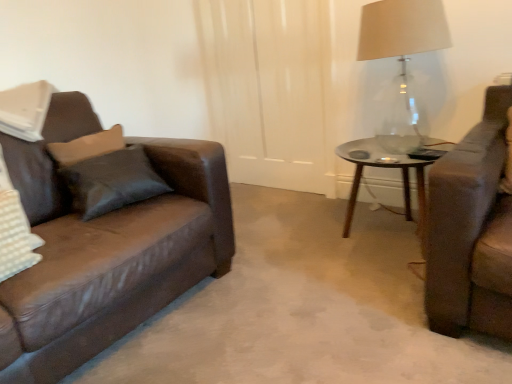
Question: From the image's perspective, does transparent glass table at center appear higher than clear glass table lamp at upper right?

Choices:
 (A) no
 (B) yes

Answer: (A)

Question: Is transparent glass table at center oriented towards clear glass table lamp at upper right?

Choices:
 (A) yes
 (B) no

Answer: (B)

Question: Can you confirm if transparent glass table at center is thinner than clear glass table lamp at upper right?

Choices:
 (A) no
 (B) yes

Answer: (A)

Question: Is transparent glass table at center at the left side of clear glass table lamp at upper right?

Choices:
 (A) no
 (B) yes

Answer: (A)

Question: Considering the relative sizes of transparent glass table at center and clear glass table lamp at upper right in the image provided, is transparent glass table at center taller than clear glass table lamp at upper right?

Choices:
 (A) yes
 (B) no

Answer: (B)

Question: Does transparent glass table at center contain clear glass table lamp at upper right?

Choices:
 (A) no
 (B) yes

Answer: (A)

Question: Is clear glass table lamp at upper right smaller than transparent glass table at center?

Choices:
 (A) yes
 (B) no

Answer: (B)

Question: Is clear glass table lamp at upper right facing away from transparent glass table at center?

Choices:
 (A) yes
 (B) no

Answer: (B)

Question: Does clear glass table lamp at upper right have a lesser height compared to transparent glass table at center?

Choices:
 (A) yes
 (B) no

Answer: (B)

Question: Is clear glass table lamp at upper right positioned beyond the bounds of transparent glass table at center?

Choices:
 (A) yes
 (B) no

Answer: (A)

Question: Is clear glass table lamp at upper right aimed at transparent glass table at center?

Choices:
 (A) yes
 (B) no

Answer: (B)

Question: Is clear glass table lamp at upper right wider than transparent glass table at center?

Choices:
 (A) no
 (B) yes

Answer: (A)

Question: Based on their sizes in the image, would you say clear glass table lamp at upper right is bigger or smaller than transparent glass table at center?

Choices:
 (A) big
 (B) small

Answer: (A)